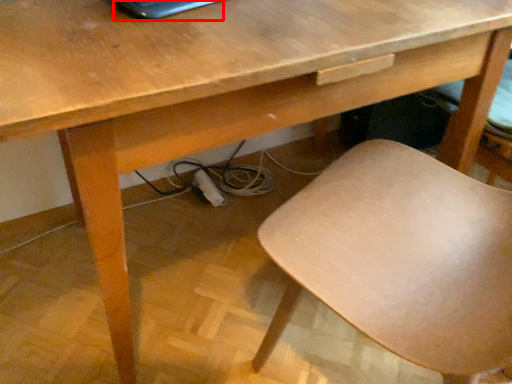
Question: Observing the image, what is the correct spatial positioning of laptop (annotated by the red box) in reference to chair?

Choices:
 (A) left
 (B) right

Answer: (A)